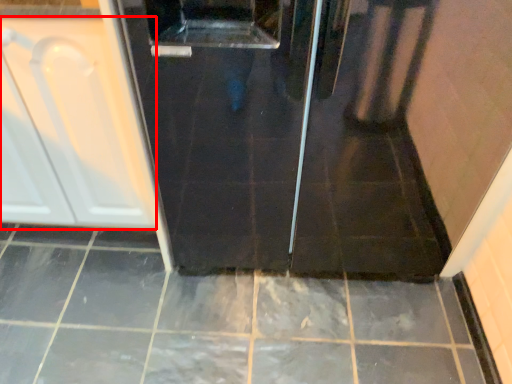
Question: In this image, where is cabinetry (annotated by the red box) located relative to ceramic tile?

Choices:
 (A) right
 (B) left

Answer: (B)